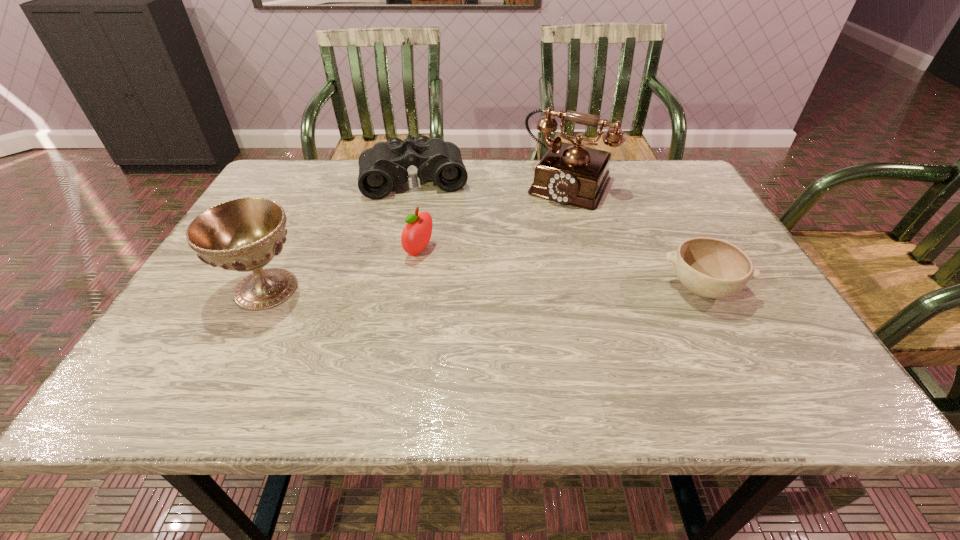
This screenshot has height=540, width=960. Identify the location of free spot that satisfies the following two spatial constraints: 1. on the front side of the bowl; 2. on the left side of the apple. (414, 288).

At what (x,y) coordinates should I click in order to perform the action: click on vacant space that satisfies the following two spatial constraints: 1. on the front side of the bowl; 2. on the left side of the apple. Please return your answer as a coordinate pair (x, y). Looking at the image, I should click on (414, 288).